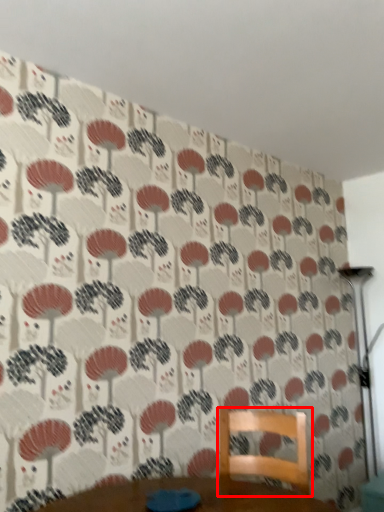
Question: Where is furniture (annotated by the red box) located in relation to table lamp in the image?

Choices:
 (A) right
 (B) left

Answer: (B)